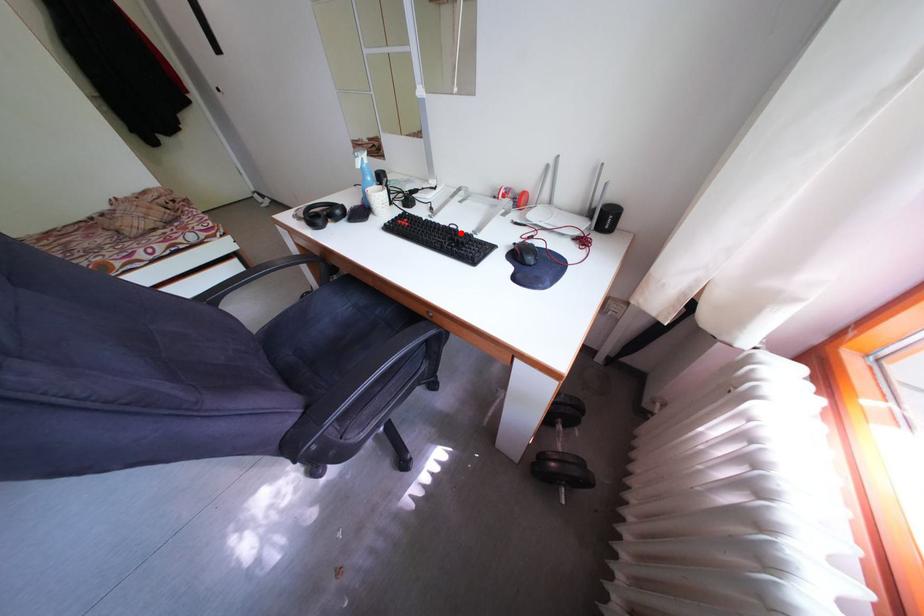
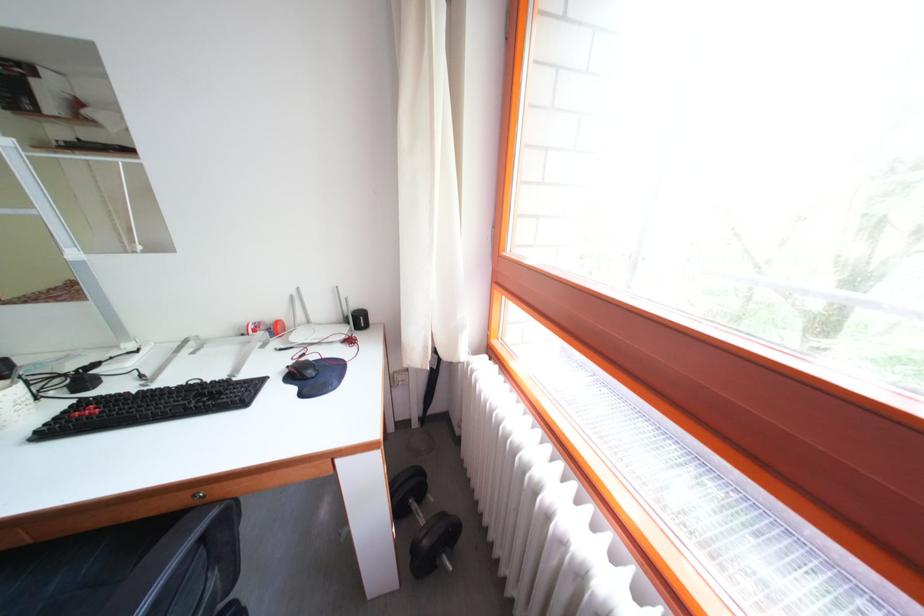
Find the pixel in the second image that matches the highlighted location in the first image.

(201, 389)